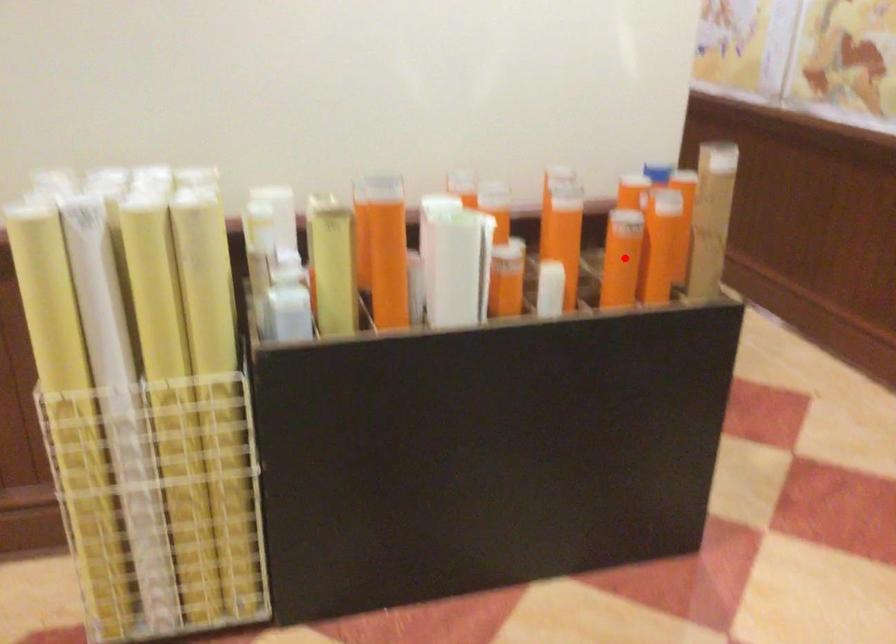
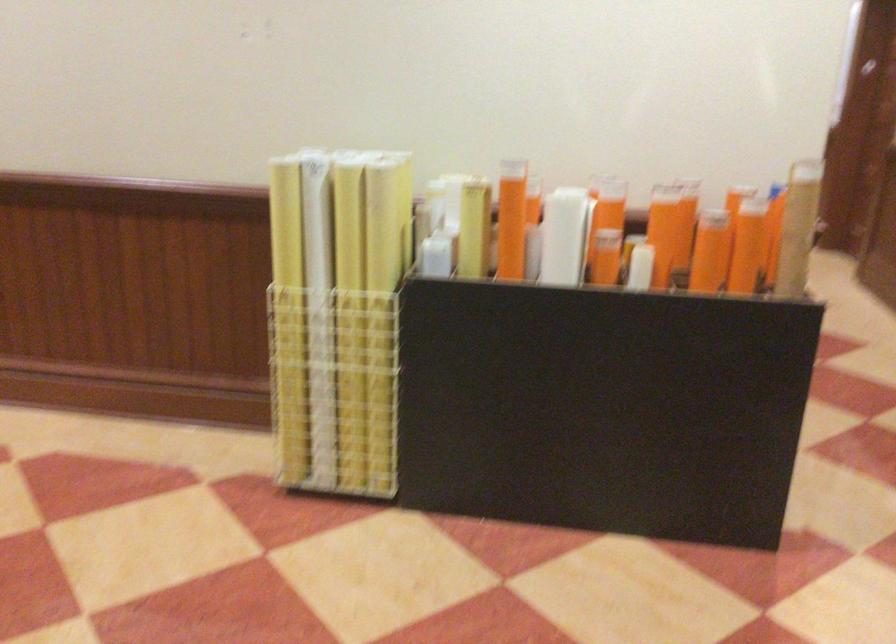
Question: I am providing you with two images of the same scene from different viewpoints. Given a red point in image1, look at the same physical point in image2. Is it:

Choices:
 (A) Closer to the viewpoint
 (B) Farther from the viewpoint

Answer: (B)